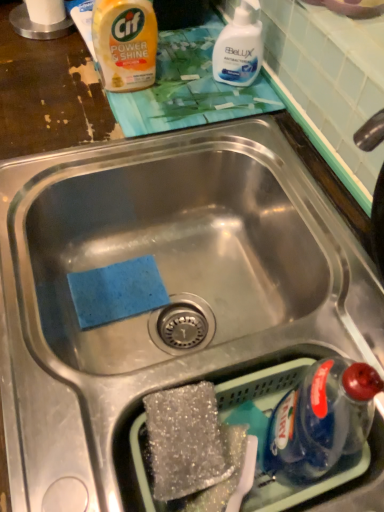
Question: Considering the relative positions of white glossy liquid at upper center and sparkly silver sponge at bottom center in the image provided, is white glossy liquid at upper center to the left of sparkly silver sponge at bottom center from the viewer's perspective?

Choices:
 (A) no
 (B) yes

Answer: (A)

Question: Considering the relative positions of white glossy liquid at upper center and sparkly silver sponge at bottom center in the image provided, is white glossy liquid at upper center behind sparkly silver sponge at bottom center?

Choices:
 (A) yes
 (B) no

Answer: (A)

Question: Is white glossy liquid at upper center at the right side of sparkly silver sponge at bottom center?

Choices:
 (A) yes
 (B) no

Answer: (A)

Question: Is white glossy liquid at upper center oriented away from sparkly silver sponge at bottom center?

Choices:
 (A) yes
 (B) no

Answer: (B)

Question: From a real-world perspective, is white glossy liquid at upper center physically below sparkly silver sponge at bottom center?

Choices:
 (A) no
 (B) yes

Answer: (A)

Question: Considering the positions of sparkly silver sponge at bottom center and white glossy liquid at upper center in the image, is sparkly silver sponge at bottom center taller or shorter than white glossy liquid at upper center?

Choices:
 (A) short
 (B) tall

Answer: (A)

Question: From the image's perspective, is sparkly silver sponge at bottom center located above or below white glossy liquid at upper center?

Choices:
 (A) above
 (B) below

Answer: (B)

Question: Considering the positions of point (210, 445) and point (261, 49), is point (210, 445) closer or farther from the camera than point (261, 49)?

Choices:
 (A) farther
 (B) closer

Answer: (B)

Question: From a real-world perspective, relative to white glossy liquid at upper center, is sparkly silver sponge at bottom center vertically above or below?

Choices:
 (A) above
 (B) below

Answer: (B)

Question: Visually, is sparkly silver sponge at bottom center positioned to the left or to the right of yellow plastic bottle at upper left?

Choices:
 (A) right
 (B) left

Answer: (A)

Question: Is sparkly silver sponge at bottom center wider or thinner than yellow plastic bottle at upper left?

Choices:
 (A) thin
 (B) wide

Answer: (B)

Question: From the image's perspective, relative to yellow plastic bottle at upper left, is sparkly silver sponge at bottom center above or below?

Choices:
 (A) below
 (B) above

Answer: (A)

Question: Considering the positions of sparkly silver sponge at bottom center and yellow plastic bottle at upper left in the image, is sparkly silver sponge at bottom center taller or shorter than yellow plastic bottle at upper left?

Choices:
 (A) short
 (B) tall

Answer: (A)

Question: Is yellow plastic bottle at upper left situated inside white glossy liquid at upper center or outside?

Choices:
 (A) inside
 (B) outside

Answer: (B)

Question: From a real-world perspective, is yellow plastic bottle at upper left above or below white glossy liquid at upper center?

Choices:
 (A) below
 (B) above

Answer: (B)